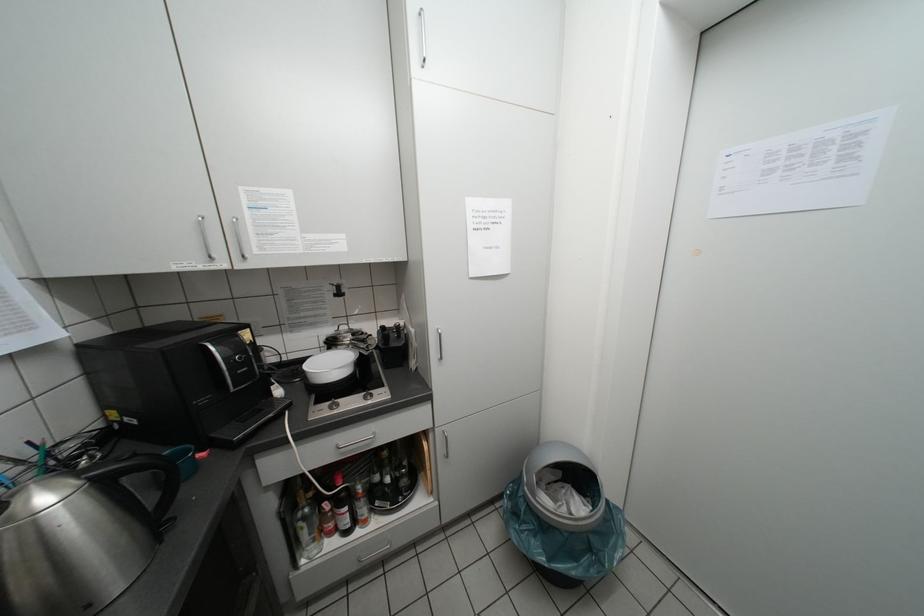
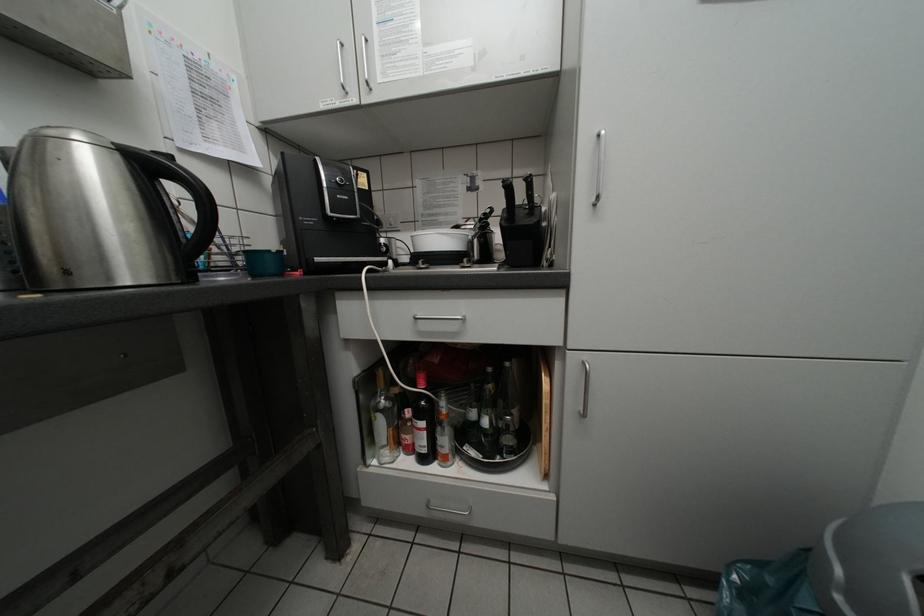
Question: How did the camera likely rotate?

Choices:
 (A) Left
 (B) Right
 (C) Up
 (D) Down

Answer: (A)